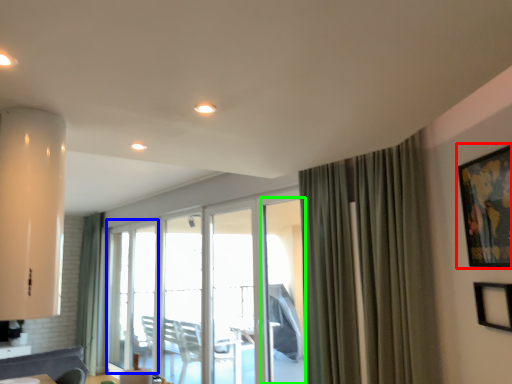
Question: Which is nearer to the picture frame (highlighted by a red box)? glass door (highlighted by a blue box) or screen door (highlighted by a green box).

Choices:
 (A) glass door
 (B) screen door

Answer: (B)